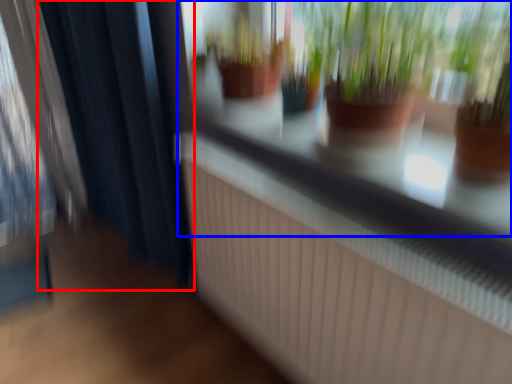
Question: Which object is further to the camera taking this photo, curtain (highlighted by a red box) or shop window (highlighted by a blue box)?

Choices:
 (A) curtain
 (B) shop window

Answer: (A)